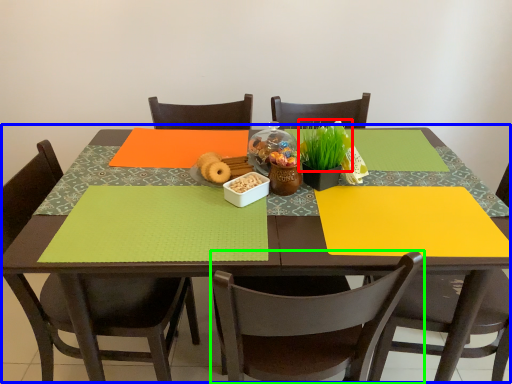
Question: Which is farther away from plant (highlighted by a red box)? table (highlighted by a blue box) or chair (highlighted by a green box)?

Choices:
 (A) table
 (B) chair

Answer: (B)